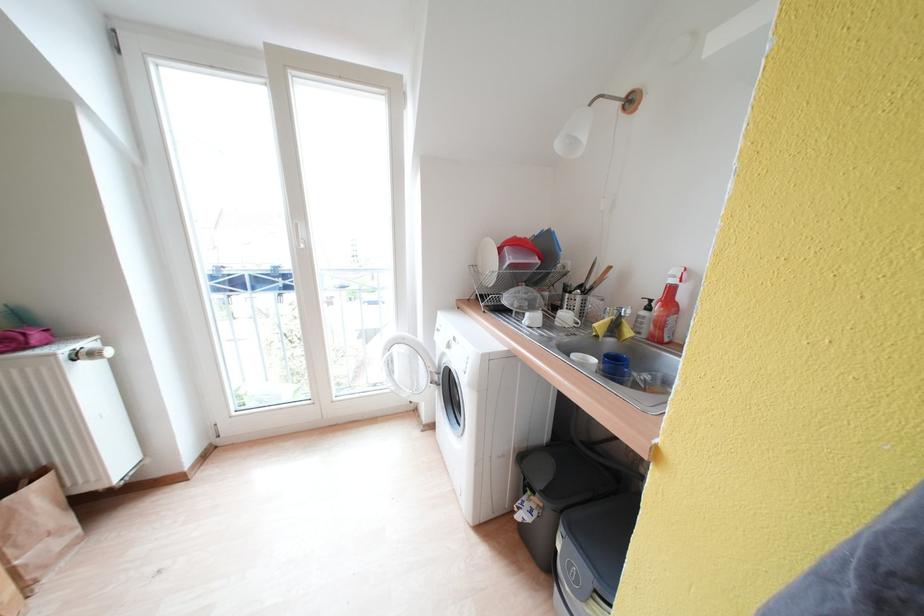
The height and width of the screenshot is (616, 924). What do you see at coordinates (298, 233) in the screenshot? I see `the white door handle` at bounding box center [298, 233].